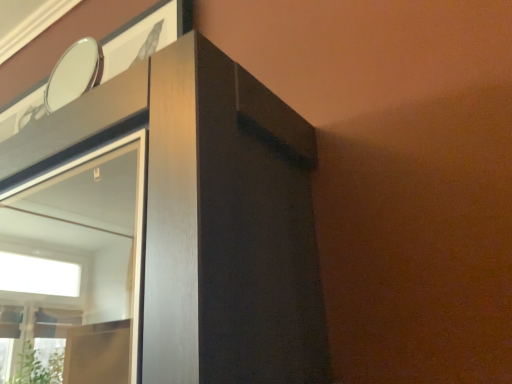
Question: In terms of width, does matte wood dresser at upper left look wider or thinner when compared to metallic silver mirror at upper left?

Choices:
 (A) wide
 (B) thin

Answer: (A)

Question: Which is correct: matte wood dresser at upper left is inside metallic silver mirror at upper left, or outside of it?

Choices:
 (A) inside
 (B) outside

Answer: (B)

Question: In terms of size, does matte wood dresser at upper left appear bigger or smaller than metallic silver mirror at upper left?

Choices:
 (A) big
 (B) small

Answer: (A)

Question: Is metallic silver mirror at upper left bigger or smaller than matte wood dresser at upper left?

Choices:
 (A) big
 (B) small

Answer: (B)

Question: Is metallic silver mirror at upper left inside the boundaries of matte wood dresser at upper left, or outside?

Choices:
 (A) outside
 (B) inside

Answer: (A)

Question: In the image, is metallic silver mirror at upper left positioned in front of or behind matte wood dresser at upper left?

Choices:
 (A) behind
 (B) front

Answer: (A)

Question: Considering the positions of metallic silver mirror at upper left and matte wood dresser at upper left in the image, is metallic silver mirror at upper left taller or shorter than matte wood dresser at upper left?

Choices:
 (A) short
 (B) tall

Answer: (A)